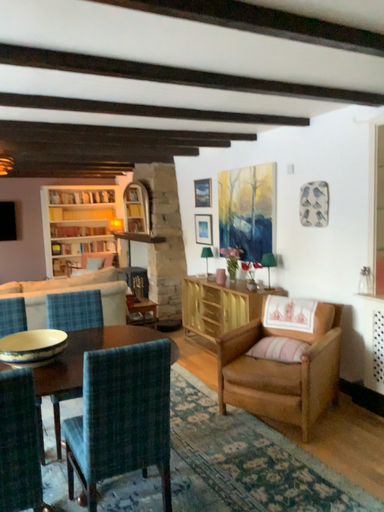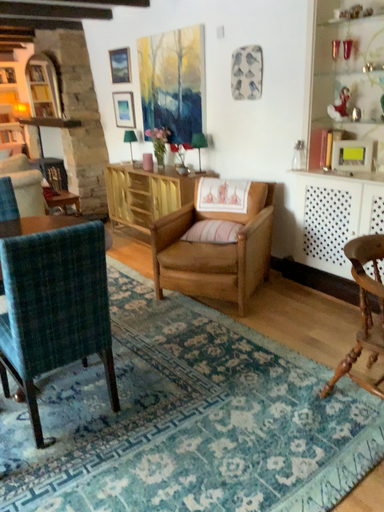
Question: Which way did the camera rotate in the video?

Choices:
 (A) rotated downward
 (B) rotated upward

Answer: (A)